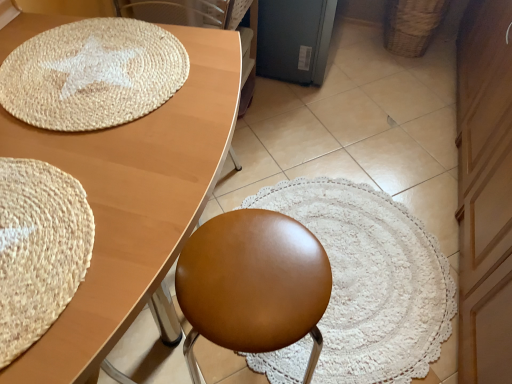
This screenshot has height=384, width=512. Identify the location of unoccupied region to the right of satin brown stool at center. (369, 316).